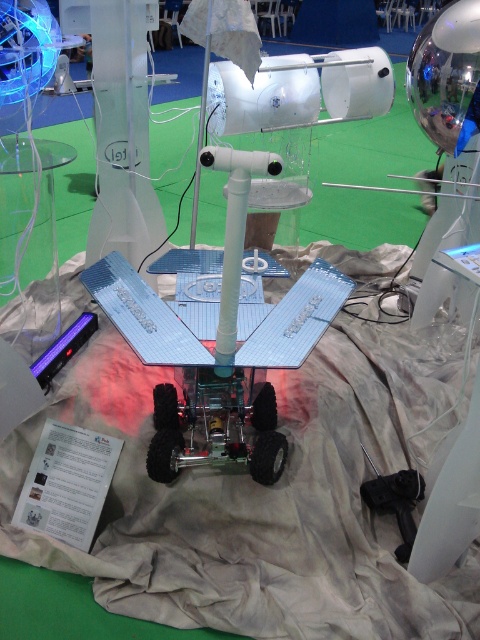
You are at the exhibition and want to place a small model of the rover on the transparent glass table at left without blocking the view of the white fabric at center. Is this possible?

The white fabric at center is in front of the transparent glass table at left, so placing the model on the table would not block the view of the fabric since the table is behind the fabric.